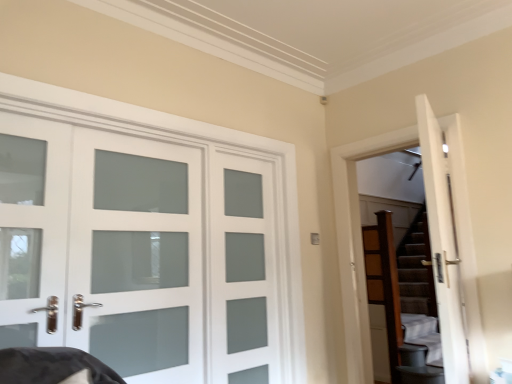
Question: Is white frosted glass door at left outside white frosted glass door at left, marked as the 1th screen door in a left-to-right arrangement?

Choices:
 (A) no
 (B) yes

Answer: (B)

Question: Considering the relative sizes of white frosted glass door at left and white frosted glass door at left, the second screen door when ordered from right to left, in the image provided, is white frosted glass door at left thinner than white frosted glass door at left, the second screen door when ordered from right to left,?

Choices:
 (A) no
 (B) yes

Answer: (A)

Question: Is white frosted glass door at left looking in the opposite direction of white frosted glass door at left, marked as the 1th screen door in a left-to-right arrangement?

Choices:
 (A) no
 (B) yes

Answer: (B)

Question: Is white frosted glass door at left not close to white frosted glass door at left, marked as the 1th screen door in a left-to-right arrangement?

Choices:
 (A) yes
 (B) no

Answer: (B)

Question: From the image's perspective, is white frosted glass door at left beneath white frosted glass door at left, the second screen door when ordered from right to left?

Choices:
 (A) yes
 (B) no

Answer: (A)

Question: Would you say wooden dresser at right is to the left or to the right of satin glass door at center, which is counted as the 1th screen door, starting from the right, in the picture?

Choices:
 (A) left
 (B) right

Answer: (B)

Question: From the image's perspective, is wooden dresser at right positioned above or below satin glass door at center, which is counted as the second screen door, starting from the left?

Choices:
 (A) above
 (B) below

Answer: (B)

Question: Is wooden dresser at right taller or shorter than satin glass door at center, which is counted as the 1th screen door, starting from the right?

Choices:
 (A) short
 (B) tall

Answer: (B)

Question: Considering the positions of point (368, 243) and point (210, 216), is point (368, 243) closer or farther from the camera than point (210, 216)?

Choices:
 (A) closer
 (B) farther

Answer: (B)

Question: In the image, is wooden dresser at right positioned in front of or behind brown textured stairs at right?

Choices:
 (A) front
 (B) behind

Answer: (B)

Question: From a real-world perspective, is wooden dresser at right physically located above or below brown textured stairs at right?

Choices:
 (A) below
 (B) above

Answer: (A)

Question: In terms of size, does wooden dresser at right appear bigger or smaller than brown textured stairs at right?

Choices:
 (A) small
 (B) big

Answer: (A)

Question: Is wooden dresser at right inside or outside of brown textured stairs at right?

Choices:
 (A) inside
 (B) outside

Answer: (B)

Question: Considering the positions of point (200, 336) and point (215, 274), is point (200, 336) closer or farther from the camera than point (215, 274)?

Choices:
 (A) closer
 (B) farther

Answer: (A)

Question: Would you say white frosted glass door at left, the second screen door when ordered from right to left, is inside or outside satin glass door at center, which is counted as the second screen door, starting from the left?

Choices:
 (A) inside
 (B) outside

Answer: (B)